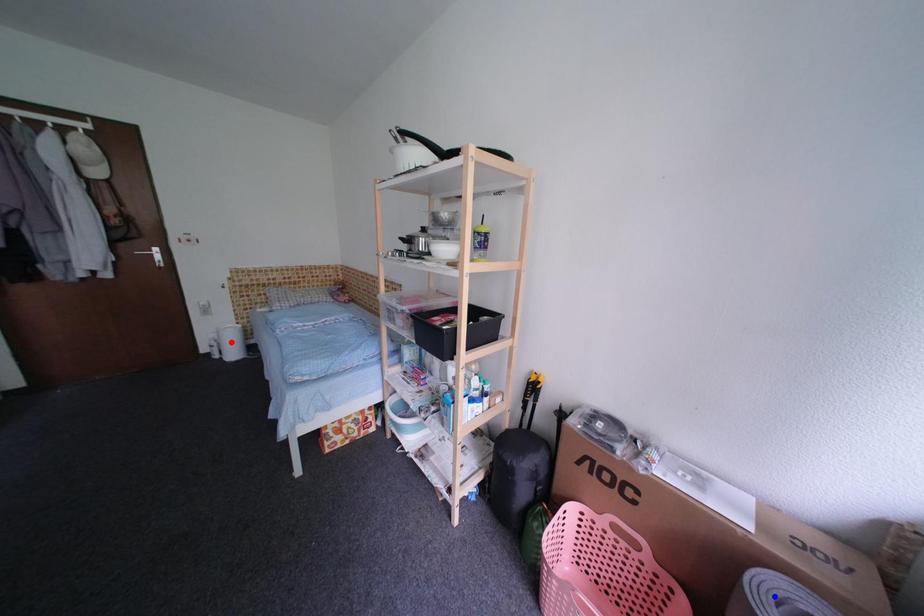
Question: In the image, two points are highlighted. Which point is nearer to the camera? Reply with the corresponding letter.

Choices:
 (A) blue point
 (B) red point

Answer: (A)